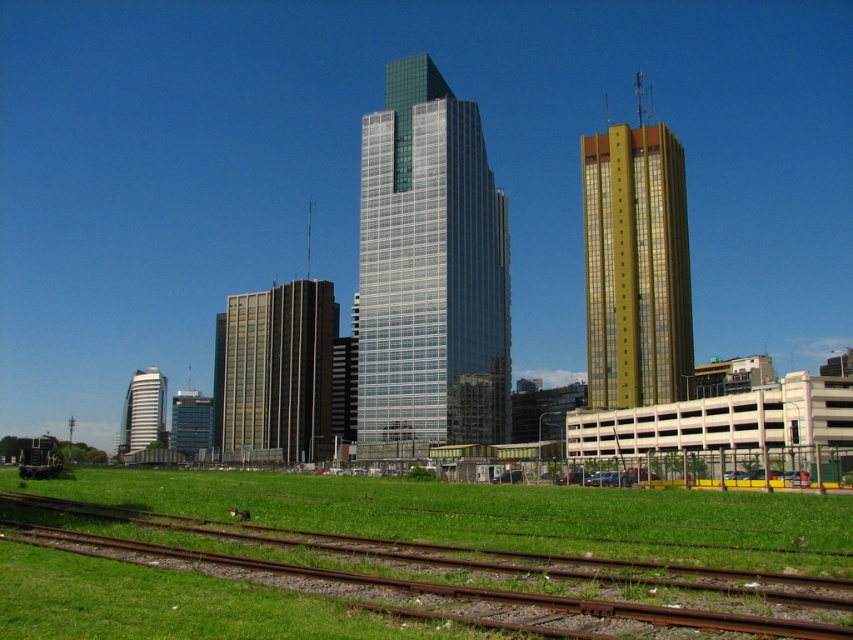
Question: Can you confirm if brown rusty tracks at lower center is thinner than white glossy building at center?

Choices:
 (A) no
 (B) yes

Answer: (B)

Question: Can you confirm if brown rusty tracks at lower center is bigger than gold/glassy building at right?

Choices:
 (A) no
 (B) yes

Answer: (A)

Question: Which object appears closest to the camera in this image?

Choices:
 (A) gold/glassy building at right
 (B) brown glass building at center
 (C) white glossy building at center

Answer: (A)

Question: Does brown rusty tracks at lower center lie behind brown glass building at center?

Choices:
 (A) yes
 (B) no

Answer: (B)

Question: Estimate the real-world distances between objects in this image. Which object is closer to the white glossy building at center?

Choices:
 (A) brown glass building at center
 (B) brown rusty tracks at lower center

Answer: (A)

Question: Which point is farther to the camera?

Choices:
 (A) (314, 292)
 (B) (143, 636)

Answer: (A)